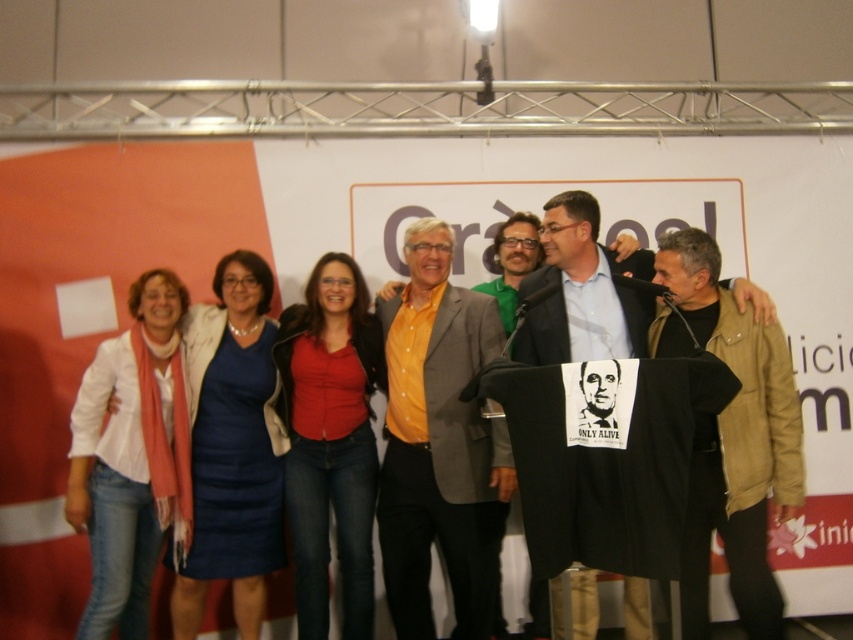
Question: Which object appears closest to the camera in this image?

Choices:
 (A) brown leather jacket at right
 (B) blue dress at center
 (C) yellow cotton shirt at center

Answer: (A)

Question: Which object is positioned closest to the brown leather jacket at right?

Choices:
 (A) blue dress at center
 (B) white matte scarf at left

Answer: (A)

Question: Does brown leather jacket at right have a smaller size compared to blue dress at center?

Choices:
 (A) yes
 (B) no

Answer: (B)

Question: Which object is the closest to the matte red shirt at center?

Choices:
 (A) yellow cotton shirt at center
 (B) blue dress at center
 (C) white matte scarf at left
 (D) brown leather jacket at right

Answer: (B)

Question: Does brown leather jacket at right appear on the right side of blue dress at center?

Choices:
 (A) yes
 (B) no

Answer: (A)

Question: Is brown leather jacket at right thinner than blue dress at center?

Choices:
 (A) yes
 (B) no

Answer: (B)